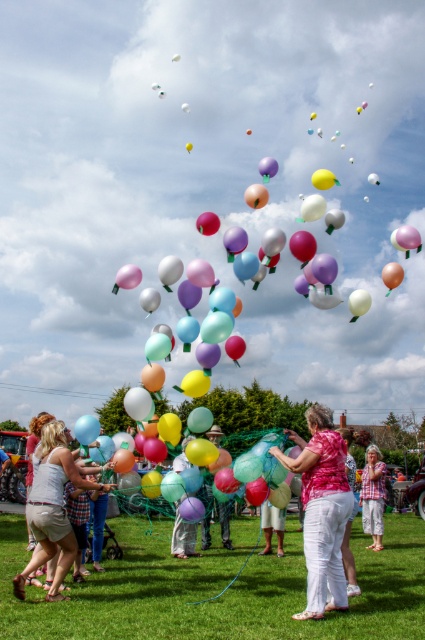
Question: Can you confirm if matte white shorts at lower left is positioned to the right of pink cotton shirt at center?

Choices:
 (A) yes
 (B) no

Answer: (B)

Question: Which point appears farthest from the camera in this image?

Choices:
 (A) (274, 445)
 (B) (365, 500)

Answer: (B)

Question: Is the position of translucent plastic balloons at center less distant than that of matte white shorts at lower left?

Choices:
 (A) no
 (B) yes

Answer: (B)

Question: Which object is farther from the camera taking this photo?

Choices:
 (A) pink fabric at center
 (B) pink cotton shirt at center
 (C) matte white shorts at lower left

Answer: (B)

Question: Among these points, which one is nearest to the camera?

Choices:
 (A) (300, 605)
 (B) (62, 580)
 (C) (340, 554)
 (D) (379, 461)

Answer: (C)

Question: From the image, what is the correct spatial relationship of pink fabric at center in relation to pink cotton shirt at center?

Choices:
 (A) above
 (B) below

Answer: (A)